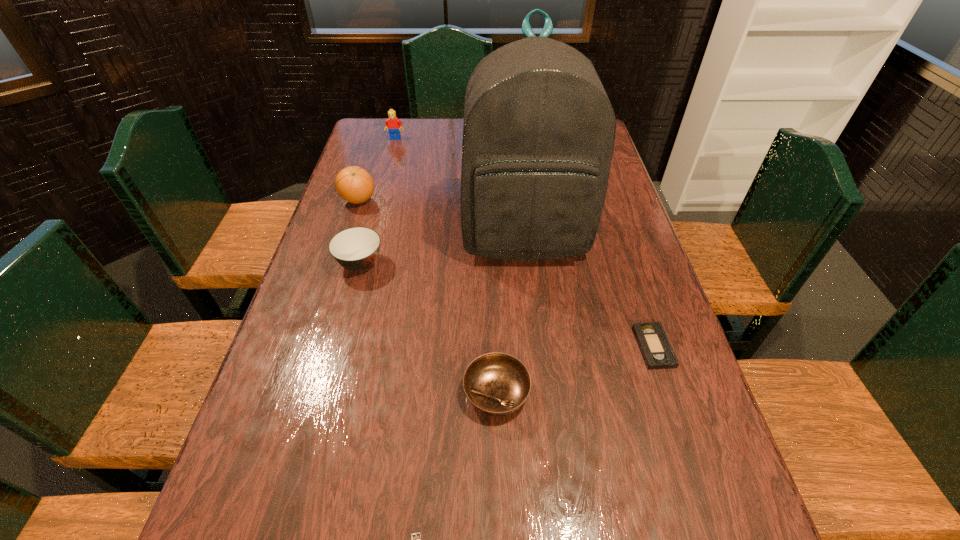
Locate an element on the screen. This screenshot has width=960, height=540. blank space located on the back of the orange is located at coordinates (369, 169).

Locate an element on the screen. The height and width of the screenshot is (540, 960). free space located on the face of the farthest object is located at coordinates (378, 204).

You are a GUI agent. You are given a task and a screenshot of the screen. Output one action in this format:
    pyautogui.click(x=<x>, y=<y>)
    Task: Click on the vacant space located 0.090m on the back of the left soup bowl
    The height and width of the screenshot is (540, 960).
    Given the screenshot: What is the action you would take?
    pyautogui.click(x=370, y=227)

Locate an element on the screen. Image resolution: width=960 pixels, height=540 pixels. vacant space located 0.200m on the back of the shorter soup bowl is located at coordinates [x=493, y=297].

Identify the location of vacant space located 0.320m on the left of the videotape. This screenshot has width=960, height=540. (497, 347).

In order to click on object present at the far edge in this screenshot , I will do coord(393,124).

Find the location of a particular element. The height and width of the screenshot is (540, 960). orange that is at the left edge is located at coordinates (354, 184).

Find the location of a particular element. The height and width of the screenshot is (540, 960). Lego situated at the left edge is located at coordinates (393, 124).

Where is `soup bowl that is at the left edge`? soup bowl that is at the left edge is located at coordinates (356, 249).

I want to click on backpack at the right edge, so click(x=538, y=134).